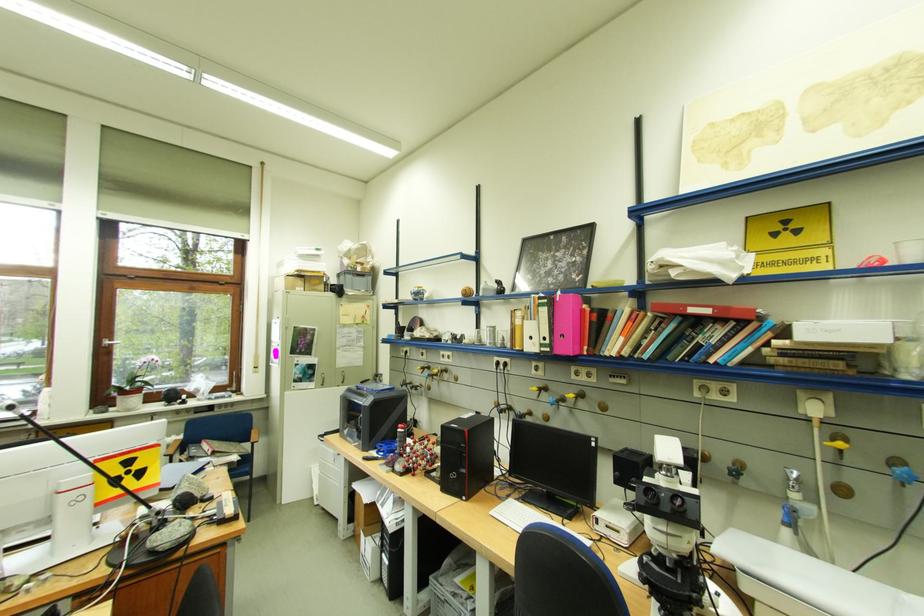
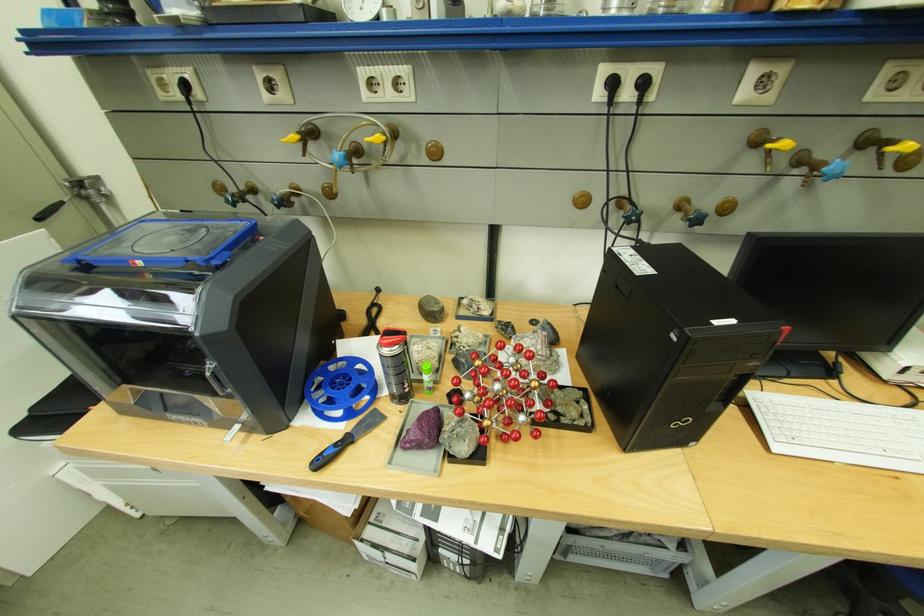
The point at (392, 455) is marked in the first image. Where is the corresponding point in the second image?

(349, 413)